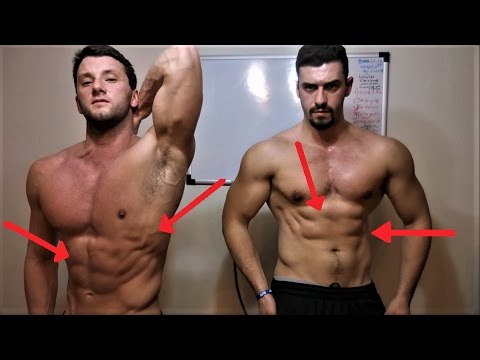
You are a GUI agent. You are given a task and a screenshot of the screen. Output one action in this format:
    pyautogui.click(x=<x>, y=<y>)
    Task: Click on the light reflections
    The image size is (480, 360).
    Given the screenshot: What is the action you would take?
    pyautogui.click(x=256, y=79), pyautogui.click(x=292, y=76), pyautogui.click(x=320, y=70)